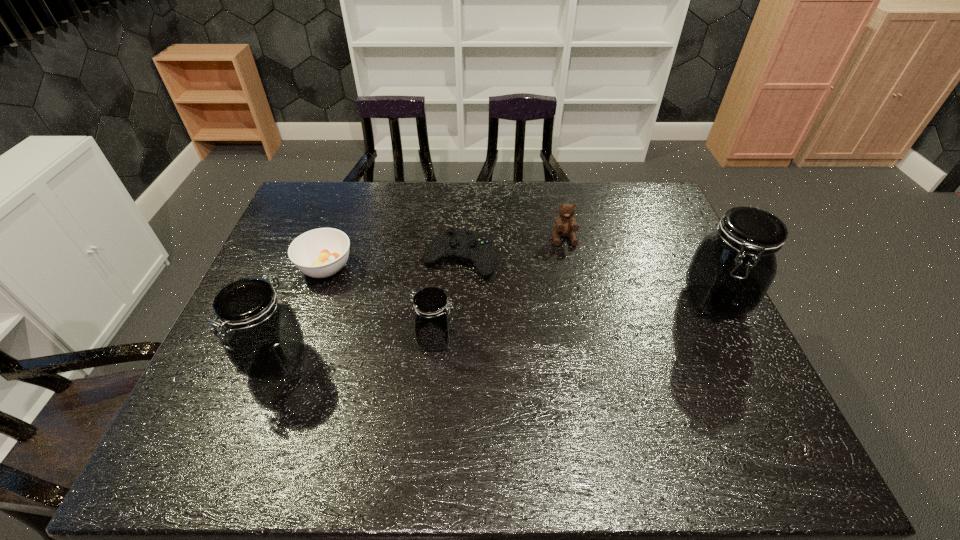
Where is `vacant position for inserting another jar evenly`? This screenshot has height=540, width=960. vacant position for inserting another jar evenly is located at coordinates (581, 319).